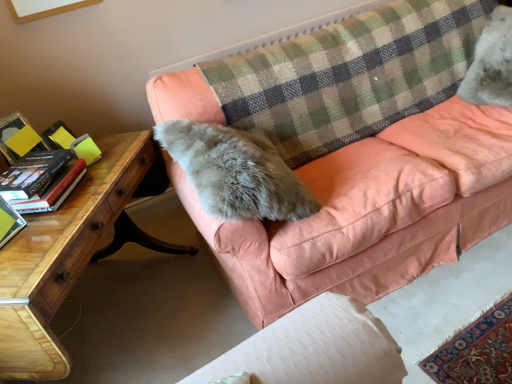
Identify the location of free space above hardcover book at left, marked as the 2th paperback book in a front-to-back arrangement (from a real-world perspective). (32, 163).